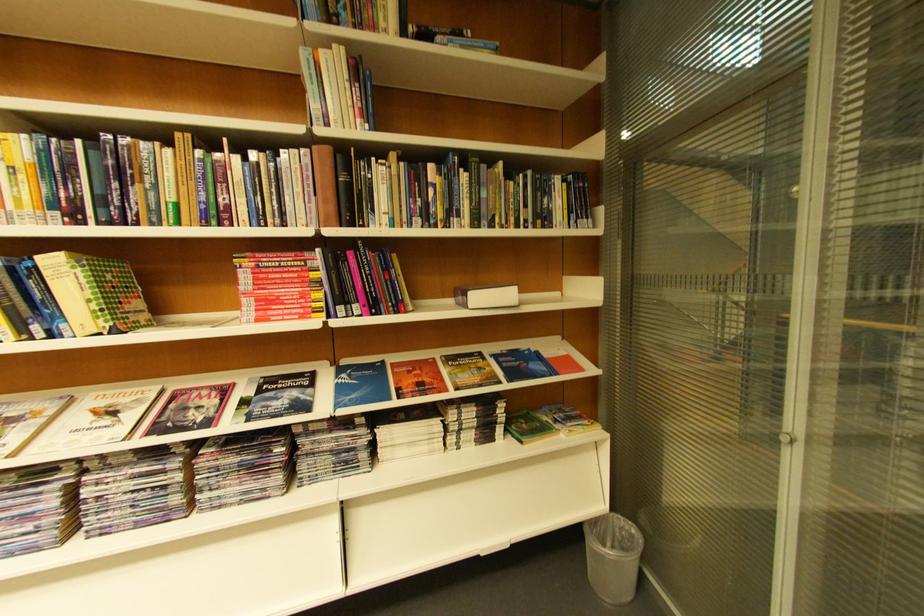
This screenshot has width=924, height=616. Find the location of `small white box`. small white box is located at coordinates (485, 296).